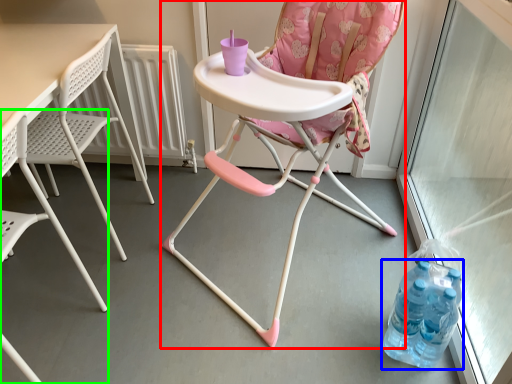
Question: Which is nearer to the chair (highlighted by a red box)? bottle (highlighted by a blue box) or chair (highlighted by a green box).

Choices:
 (A) bottle
 (B) chair

Answer: (A)